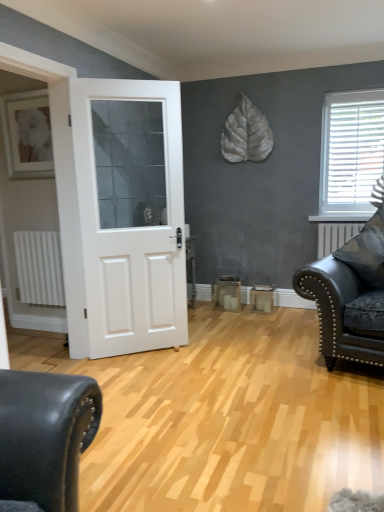
Question: Are matte black leather couch at right and white plastic blinds at upper right making contact?

Choices:
 (A) no
 (B) yes

Answer: (A)

Question: Does matte black leather couch at right appear on the left side of white plastic blinds at upper right?

Choices:
 (A) yes
 (B) no

Answer: (A)

Question: Can you confirm if matte black leather couch at right is taller than white plastic blinds at upper right?

Choices:
 (A) no
 (B) yes

Answer: (A)

Question: Can you confirm if matte black leather couch at right is smaller than white plastic blinds at upper right?

Choices:
 (A) no
 (B) yes

Answer: (A)

Question: Does matte black leather couch at right turn towards white plastic blinds at upper right?

Choices:
 (A) yes
 (B) no

Answer: (B)

Question: In terms of height, does white matte radiator at left look taller or shorter compared to white matte door at center?

Choices:
 (A) tall
 (B) short

Answer: (B)

Question: In terms of size, does white matte radiator at left appear bigger or smaller than white matte door at center?

Choices:
 (A) small
 (B) big

Answer: (A)

Question: Would you say white matte radiator at left is to the left or to the right of white matte door at center in the picture?

Choices:
 (A) left
 (B) right

Answer: (A)

Question: From the image's perspective, relative to white matte door at center, is white matte radiator at left above or below?

Choices:
 (A) above
 (B) below

Answer: (B)

Question: Do you think white plastic blinds at upper right is within matte black leather couch at right, or outside of it?

Choices:
 (A) inside
 (B) outside

Answer: (B)

Question: Is white plastic blinds at upper right in front of or behind matte black leather couch at right in the image?

Choices:
 (A) behind
 (B) front

Answer: (A)

Question: In the image, is white plastic blinds at upper right on the left side or the right side of matte black leather couch at right?

Choices:
 (A) left
 (B) right

Answer: (B)

Question: Looking at their shapes, would you say white plastic blinds at upper right is wider or thinner than matte black leather couch at right?

Choices:
 (A) thin
 (B) wide

Answer: (A)

Question: In terms of size, does matte black leather couch at right appear bigger or smaller than white matte radiator at left?

Choices:
 (A) big
 (B) small

Answer: (A)

Question: Considering their positions, is matte black leather couch at right located in front of or behind white matte radiator at left?

Choices:
 (A) behind
 (B) front

Answer: (B)